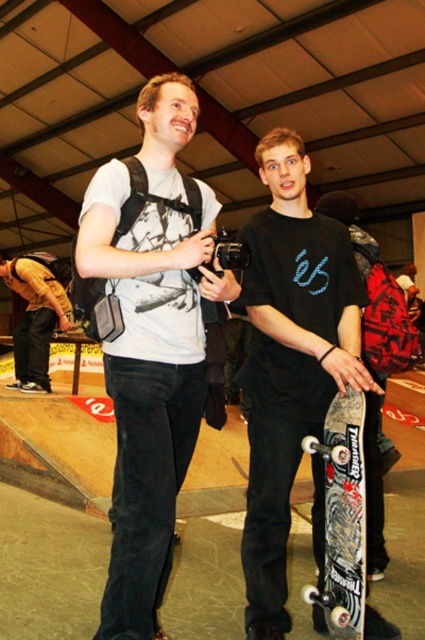
Question: Which point is farther from the camera taking this photo?

Choices:
 (A) (357, 472)
 (B) (25, 353)
 (C) (150, 100)
 (D) (277, 516)

Answer: (B)

Question: Among these objects, which one is nearest to the camera?

Choices:
 (A) black matte skateboard at center
 (B) yellow casual jacket at left
 (C) black textured skateboard at lower right
 (D) matte black t-shirt at center

Answer: (D)

Question: Can you confirm if matte black t-shirt at center is bigger than black matte skateboard at center?

Choices:
 (A) yes
 (B) no

Answer: (A)

Question: Which of these objects is positioned closest to the matte black t-shirt at center?

Choices:
 (A) black textured skateboard at lower right
 (B) black matte skateboard at center
 (C) yellow casual jacket at left

Answer: (B)

Question: Observing the image, what is the correct spatial positioning of matte black t-shirt at center in reference to black matte skateboard at center?

Choices:
 (A) left
 (B) right

Answer: (A)

Question: Is black matte skateboard at center below yellow casual jacket at left?

Choices:
 (A) yes
 (B) no

Answer: (A)